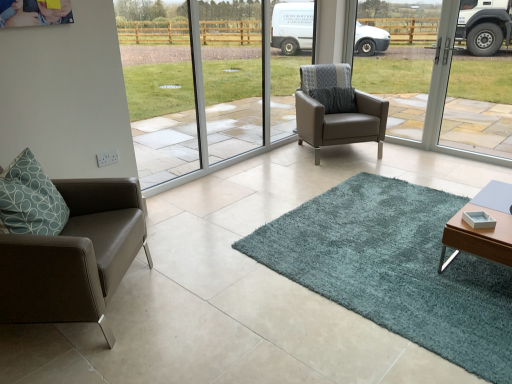
At what (x,y) coordinates should I click in order to perform the action: click on free region under wooden table at lower right (from a real-world perspective). Please return your answer as a coordinate pair (x, y). Looking at the image, I should click on (479, 269).